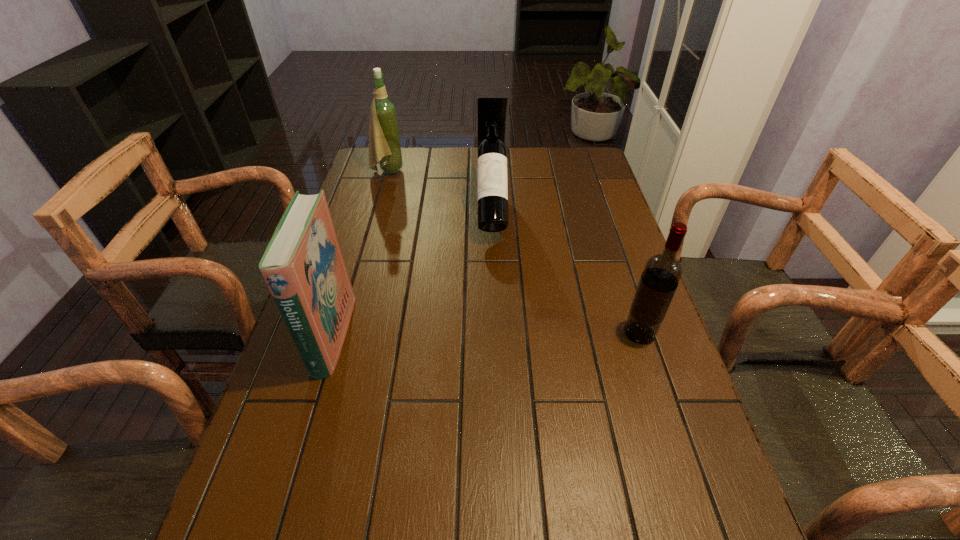
Locate an element on the screen. This screenshot has height=540, width=960. free spot that satisfies the following two spatial constraints: 1. on the stand of the second wine bottle from right to left; 2. on the cover of the hardback book is located at coordinates coord(495,335).

This screenshot has width=960, height=540. What are the coordinates of `free location that satisfies the following two spatial constraints: 1. on the stand of the second wine bottle from right to left; 2. on the right side of the nearest wine bottle` in the screenshot? It's located at (495, 333).